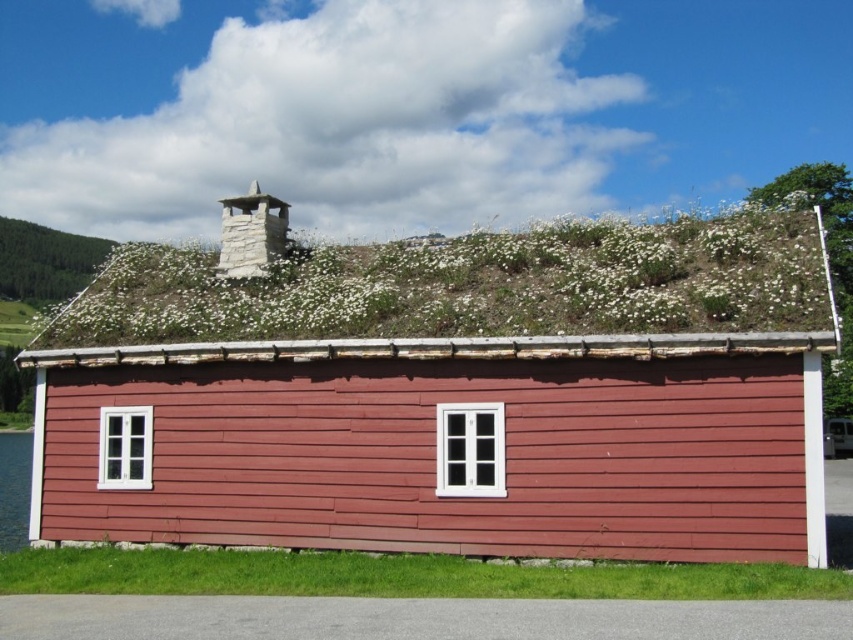
You are standing at the origin point in the image. There is a point marked at coordinates point (448, 394). What object is located at that point?

The point (448, 394) corresponds to the location of the matte red wooden hut at center.

You are planning to set up a picnic blanket in the area shown. The picnic blanket is 2 meters wide. You see the matte red wooden hut at center and the white grass at upper center. Which area can accommodate the blanket without exceeding its width?

The matte red wooden hut at center has a width that surpasses the white grass at upper center, so the picnic blanket can fit in the area of the matte red wooden hut at center since its width is wider than the blanket.